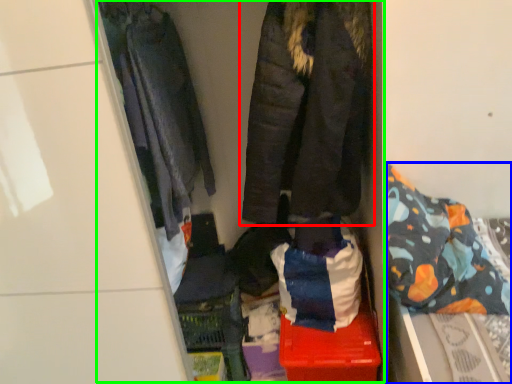
Question: Which is nearer to the jacket (highlighted by a red box)? bed (highlighted by a blue box) or closet (highlighted by a green box).

Choices:
 (A) bed
 (B) closet

Answer: (B)